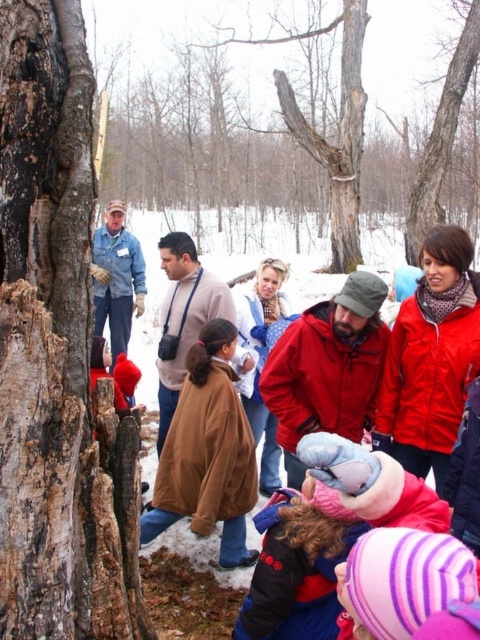
Question: Which point is farther to the camera?

Choices:
 (A) brown suede jacket at center
 (B) smooth bark tree at center
 (C) rough bark tree at center
 (D) red matte jacket at center

Answer: (C)

Question: Can you confirm if brown rough bark tree trunk at left is positioned above red matte jacket at center?

Choices:
 (A) no
 (B) yes

Answer: (B)

Question: Which point appears closest to the camera in this image?

Choices:
 (A) (78, 26)
 (B) (348, 278)

Answer: (A)

Question: Does brown rough bark tree trunk at left have a lesser width compared to light brown leather jacket at center?

Choices:
 (A) yes
 (B) no

Answer: (A)

Question: Among these objects, which one is nearest to the camera?

Choices:
 (A) light brown leather jacket at center
 (B) red matte jacket at center
 (C) smooth bark tree at center
 (D) rough bark tree at center

Answer: (B)

Question: Does rough bark tree at center appear on the right side of brown suede jacket at center?

Choices:
 (A) no
 (B) yes

Answer: (B)